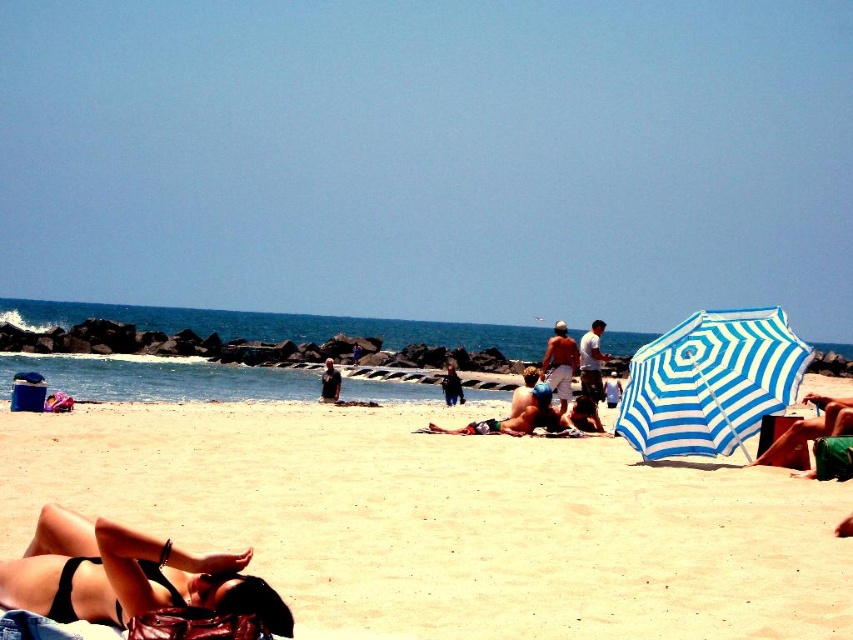
Question: Which point is farther from the camera taking this photo?

Choices:
 (A) (596, 353)
 (B) (730, 438)
 (C) (782, 442)

Answer: (A)

Question: In this image, where is beige sand at lower center located relative to dark blue denim shorts at center?

Choices:
 (A) above
 (B) below

Answer: (A)

Question: From the image, what is the correct spatial relationship of blue striped umbrella at right in relation to white cotton shorts at center?

Choices:
 (A) below
 (B) above

Answer: (B)

Question: Estimate the real-world distances between objects in this image. Which object is closer to the dark blue denim shorts at center?

Choices:
 (A) black bikini at lower left
 (B) white cotton shirt at center
 (C) beige sand at lower center
 (D) white cotton shorts at center

Answer: (B)

Question: Does black bikini at lower left appear on the left side of green cotton shorts at lower right?

Choices:
 (A) yes
 (B) no

Answer: (A)

Question: Which of these objects is positioned farthest from the dark blue t-shirt at center?

Choices:
 (A) blue striped umbrella at right
 (B) dark blue denim shorts at center
 (C) black bikini at lower left
 (D) green cotton shorts at lower right

Answer: (C)